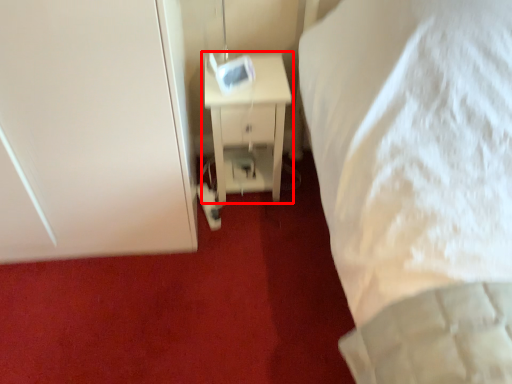
Question: From the image, what is the correct spatial relationship of nightstand (annotated by the red box) in relation to door?

Choices:
 (A) left
 (B) right

Answer: (B)